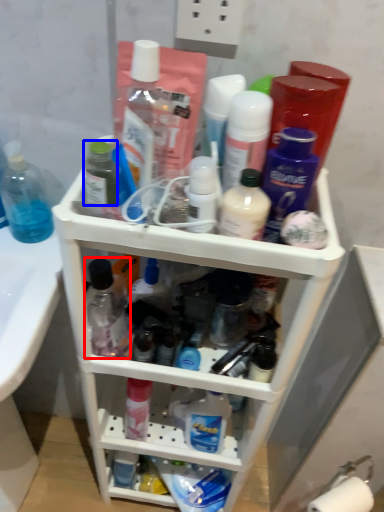
Question: Among these objects, which one is farthest to the camera, toiletry (highlighted by a red box) or toiletry (highlighted by a blue box)?

Choices:
 (A) toiletry
 (B) toiletry

Answer: (A)